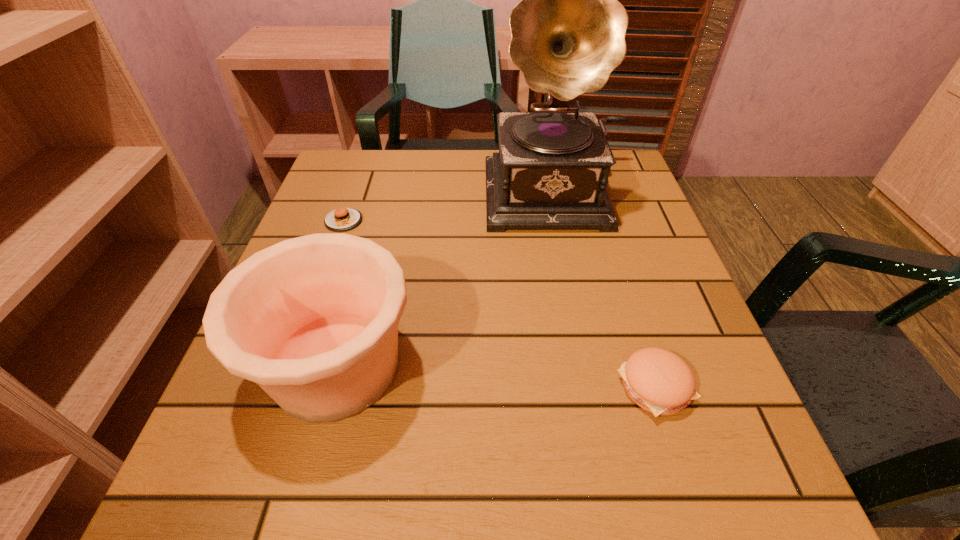
At what (x,y) coordinates should I click in order to perform the action: click on object present at the far edge. Please return your answer as a coordinate pair (x, y). Looking at the image, I should click on (568, 33).

At what (x,y) coordinates should I click in order to perform the action: click on pottery that is at the left edge. Please return your answer as a coordinate pair (x, y). This screenshot has height=540, width=960. Looking at the image, I should click on pos(313,320).

Locate an element on the screen. The image size is (960, 540). food that is positioned at the left edge is located at coordinates (342, 219).

At what (x,y) coordinates should I click in order to perform the action: click on record player at the right edge. Please return your answer as a coordinate pair (x, y). Image resolution: width=960 pixels, height=540 pixels. Looking at the image, I should click on (568, 33).

Where is `patty that is at the right edge`? The height and width of the screenshot is (540, 960). patty that is at the right edge is located at coordinates (659, 381).

At what (x,y) coordinates should I click in order to perform the action: click on object at the far right corner. Please return your answer as a coordinate pair (x, y). The width and height of the screenshot is (960, 540). Looking at the image, I should click on (568, 33).

Where is `vacant space at the far edge of the desktop`? This screenshot has height=540, width=960. vacant space at the far edge of the desktop is located at coordinates (406, 152).

Image resolution: width=960 pixels, height=540 pixels. In the image, there is a desktop. What are the coordinates of `free space at the near edge` in the screenshot? It's located at (480, 456).

You are a GUI agent. You are given a task and a screenshot of the screen. Output one action in this format:
    pyautogui.click(x=<x>, y=<y>)
    Task: Click on the free region at the left edge of the desktop
    Image resolution: width=960 pixels, height=540 pixels.
    Given the screenshot: What is the action you would take?
    pyautogui.click(x=258, y=400)

What are the coordinates of `blank space at the right edge` in the screenshot? It's located at (640, 440).